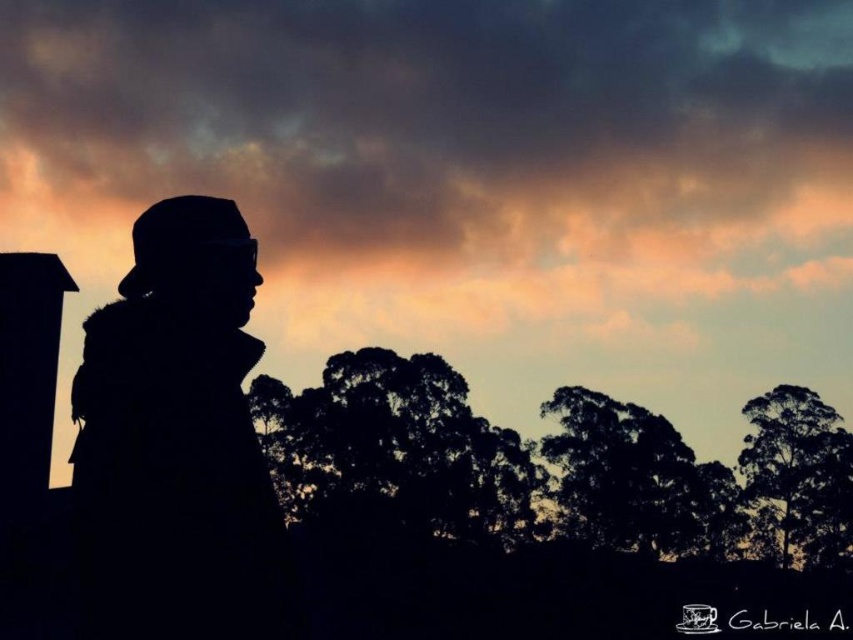
You are an artist planning to paint this scene. You want to ensure the orange sky at upper center and silhouette tree at center are proportionally accurate. Which object should you make wider in your painting?

The orange sky at upper center should be made wider in the painting since its width surpasses that of the silhouette tree at center according to the description.

You are a photographer trying to capture the sunset scene. You notice a specific point at coordinates point (445, 150) in your viewfinder. Based on the scene description, what color would this point most likely be?

The point (445, 150) is on orange sky at upper center, so the color would most likely be orange.